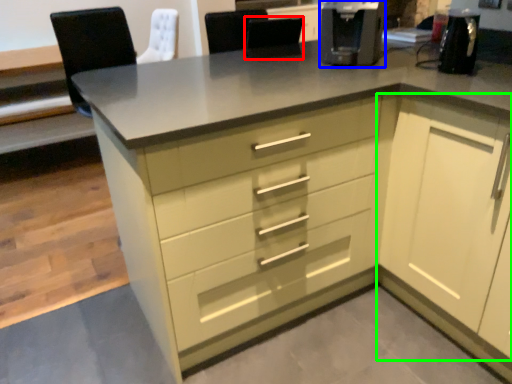
Question: Considering the real-world distances, which object is closest to chair (highlighted by a red box)? coffee machine (highlighted by a blue box) or cabinetry (highlighted by a green box).

Choices:
 (A) coffee machine
 (B) cabinetry

Answer: (A)